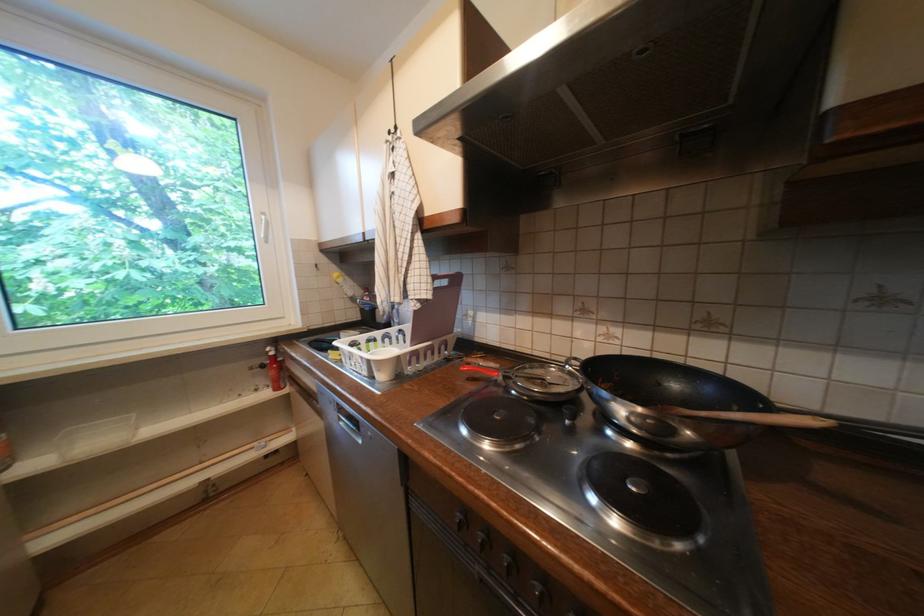
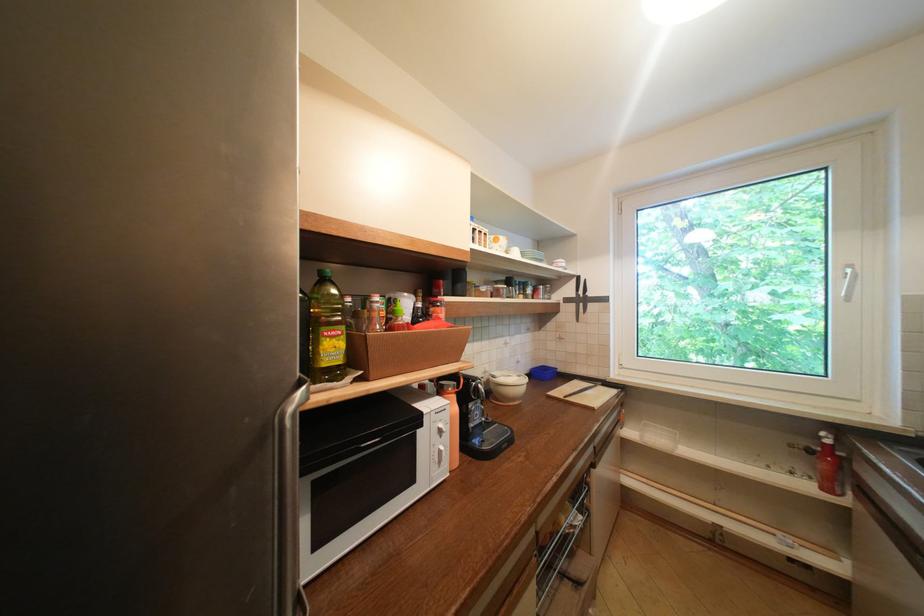
The point at [275,354] is marked in the first image. Where is the corresponding point in the second image?

(829, 439)